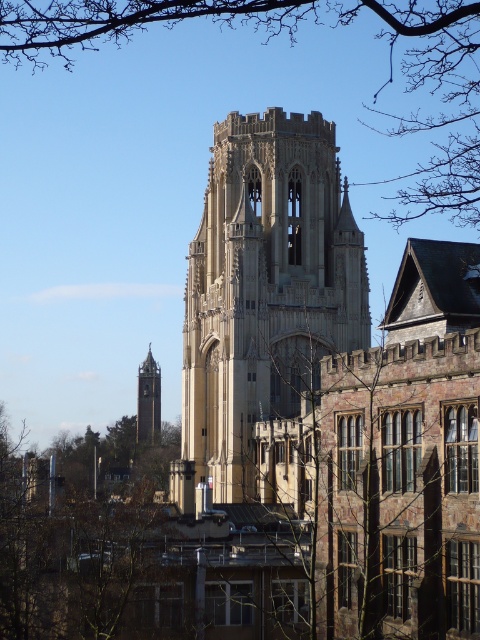
Question: Which of the following is the closest to the observer?

Choices:
 (A) (84, 4)
 (B) (292, 280)

Answer: (A)

Question: Which point is farther to the camera?

Choices:
 (A) (136, 410)
 (B) (346, 268)

Answer: (A)

Question: Can you confirm if beige stone tower at center is positioned to the right of brown leafless branches at upper center?

Choices:
 (A) no
 (B) yes

Answer: (B)

Question: Is beige stone tower at center in front of smooth stone bell tower at center?

Choices:
 (A) no
 (B) yes

Answer: (B)

Question: Is beige stone tower at center to the right of smooth stone bell tower at center from the viewer's perspective?

Choices:
 (A) yes
 (B) no

Answer: (A)

Question: Which object is the farthest from the beige stone tower at center?

Choices:
 (A) brown leafless branches at upper center
 (B) smooth stone bell tower at center

Answer: (B)